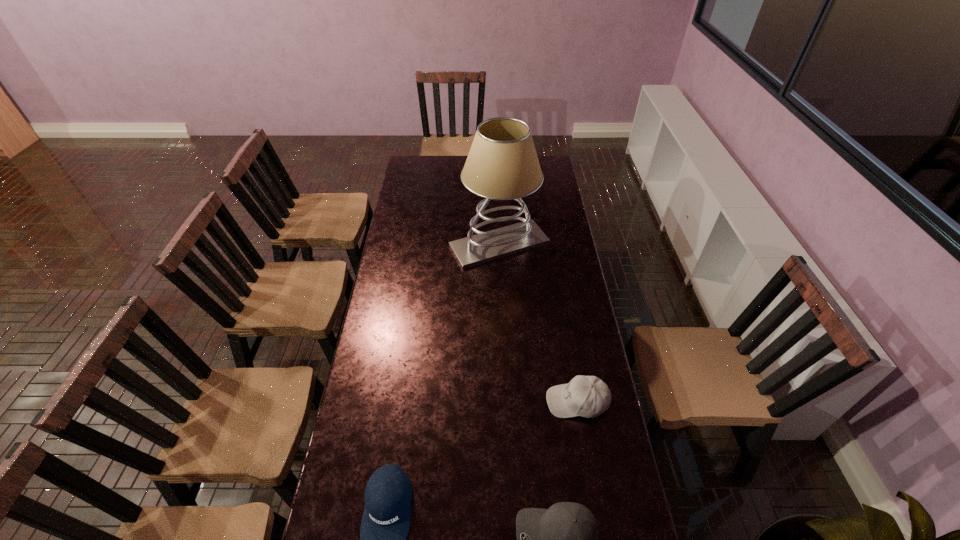
At what (x,y) coordinates should I click in order to perform the action: click on table lamp. Please return your answer as a coordinate pair (x, y). The height and width of the screenshot is (540, 960). Looking at the image, I should click on (502, 164).

The width and height of the screenshot is (960, 540). Identify the location of the farthest object. (502, 164).

At what (x,y) coordinates should I click in order to perform the action: click on the farthest baseball cap. Please return your answer as a coordinate pair (x, y). The width and height of the screenshot is (960, 540). Looking at the image, I should click on (588, 396).

Locate an element on the screen. Image resolution: width=960 pixels, height=540 pixels. free space located on the front of the tallest object is located at coordinates (502, 307).

Where is `free spot located 0.300m on the front-facing side of the second farthest object`? Image resolution: width=960 pixels, height=540 pixels. free spot located 0.300m on the front-facing side of the second farthest object is located at coordinates (457, 401).

At what (x,y) coordinates should I click in order to perform the action: click on free location located 0.240m on the front-facing side of the second farthest object. Please return your answer as a coordinate pair (x, y). Looking at the image, I should click on (475, 401).

Image resolution: width=960 pixels, height=540 pixels. I want to click on free space located on the front-facing side of the second farthest object, so click(x=505, y=401).

The width and height of the screenshot is (960, 540). I want to click on table lamp that is at the right edge, so click(x=502, y=164).

Find the location of a particular element. Image resolution: width=960 pixels, height=540 pixels. baseball cap at the right edge is located at coordinates (588, 396).

In the image, there is a desktop. Identify the location of free space at the left edge. (432, 180).